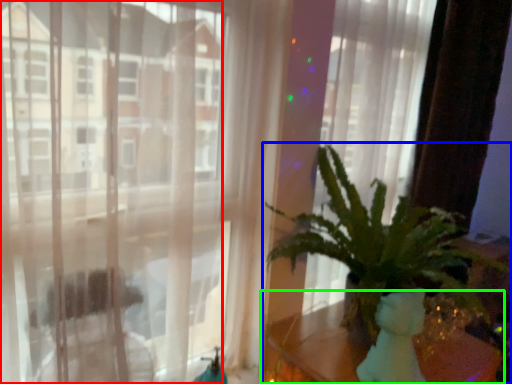
Question: Which is nearer to the window (highlighted by a red box)? houseplant (highlighted by a blue box) or table (highlighted by a green box).

Choices:
 (A) houseplant
 (B) table

Answer: (A)